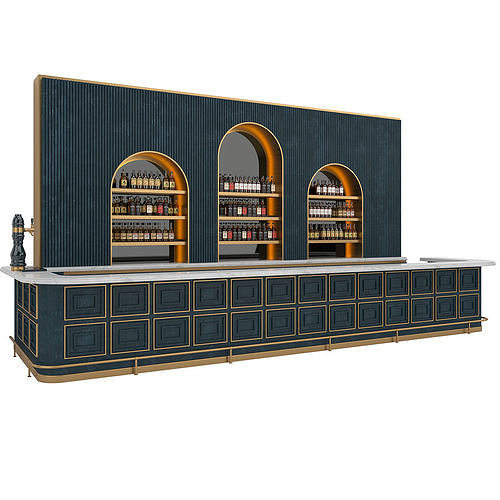
Locate an element on the screen. The image size is (500, 500). tall arched  concave shelf area, center of back wall is located at coordinates (251, 121).